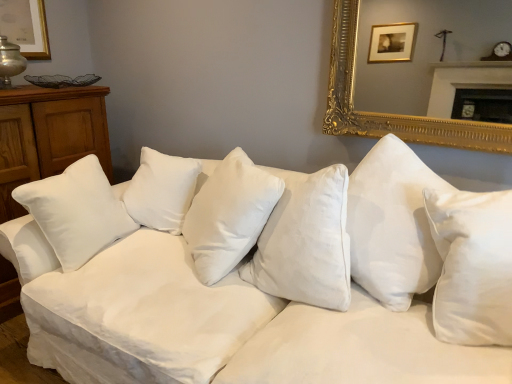
Question: Based on their sizes in the image, would you say white satin pillow at center is bigger or smaller than white cotton couch at center?

Choices:
 (A) big
 (B) small

Answer: (B)

Question: Relative to white cotton couch at center, is white satin pillow at center in front or behind?

Choices:
 (A) front
 (B) behind

Answer: (B)

Question: Is white satin pillow at center inside or outside of white cotton couch at center?

Choices:
 (A) outside
 (B) inside

Answer: (B)

Question: Considering the positions of white cotton couch at center and white satin pillow at center in the image, is white cotton couch at center wider or thinner than white satin pillow at center?

Choices:
 (A) thin
 (B) wide

Answer: (B)

Question: Relative to white satin pillow at center, is white cotton couch at center in front or behind?

Choices:
 (A) front
 (B) behind

Answer: (A)

Question: Based on their sizes in the image, would you say white cotton couch at center is bigger or smaller than white satin pillow at center?

Choices:
 (A) small
 (B) big

Answer: (B)

Question: From their relative heights in the image, would you say white cotton couch at center is taller or shorter than white satin pillow at center?

Choices:
 (A) short
 (B) tall

Answer: (B)